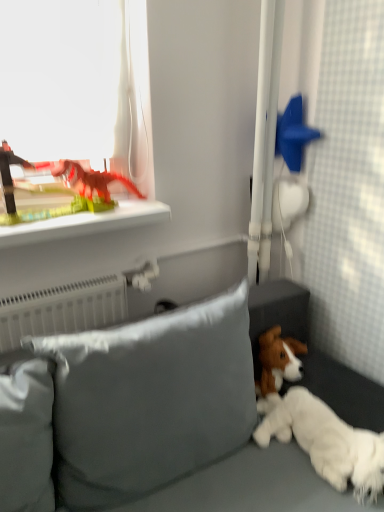
Question: Considering the positions of blue matte star at upper right, acting as the 2th toy starting from the left, and white fluffy dog at lower right in the image, is blue matte star at upper right, acting as the 2th toy starting from the left, taller or shorter than white fluffy dog at lower right?

Choices:
 (A) tall
 (B) short

Answer: (A)

Question: In the image, is blue matte star at upper right, which is the first toy from right to left, on the left side or the right side of white fluffy dog at lower right?

Choices:
 (A) right
 (B) left

Answer: (B)

Question: Which object is positioned closest to the white fluffy dog at lower right?

Choices:
 (A) matte plastic dinosaur at upper left, placed as the second toy when sorted from right to left
 (B) blue matte star at upper right, acting as the 2th toy starting from the left
 (C) satin gray pillow at lower center
 (D) transparent plastic dinosaur at upper left
 (E) green plastic dinosaur at upper left

Answer: (C)

Question: Which object is positioned farthest from the blue matte star at upper right, acting as the 2th toy starting from the left?

Choices:
 (A) matte plastic dinosaur at upper left, which is counted as the first toy, starting from the left
 (B) green plastic dinosaur at upper left
 (C) white fluffy dog at lower right
 (D) transparent plastic dinosaur at upper left
 (E) satin gray pillow at lower center

Answer: (E)